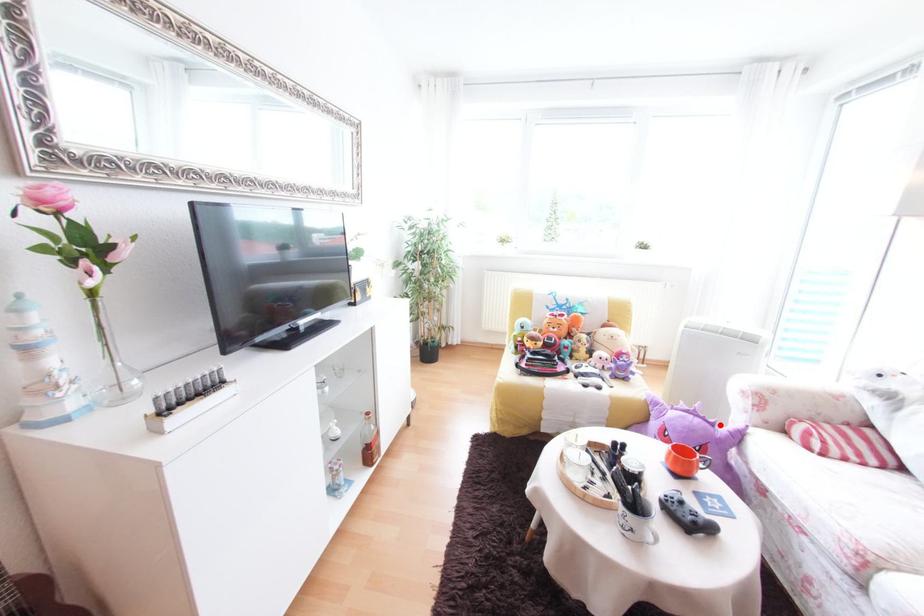
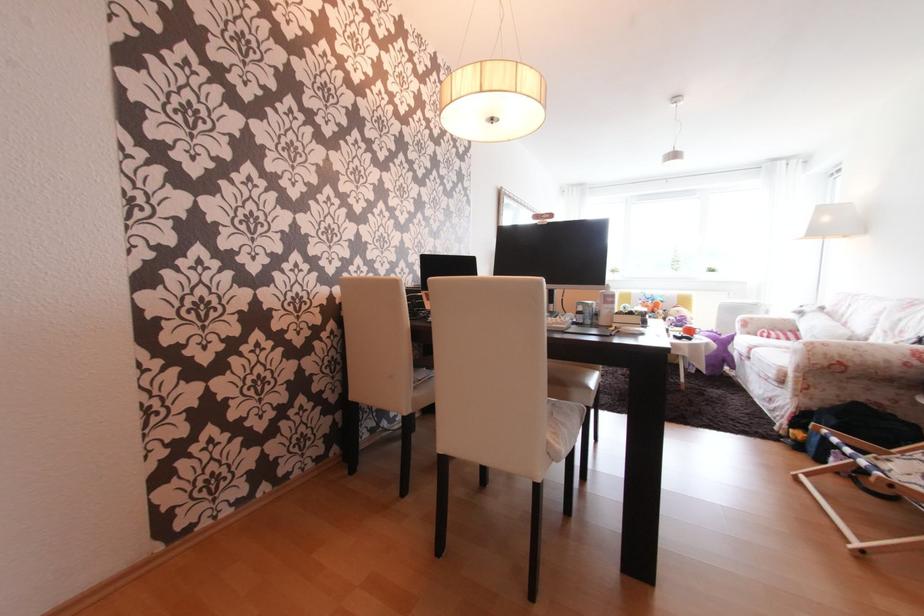
Locate, in the second image, the point that corresponds to the highlighted location in the first image.

(727, 336)